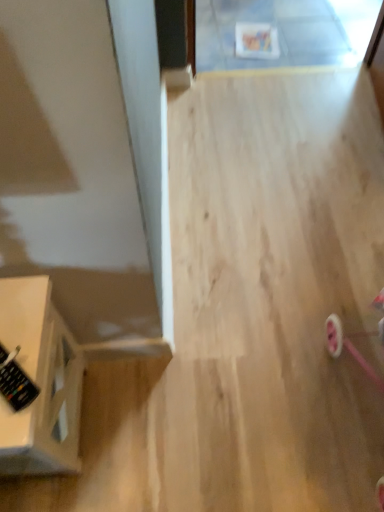
Question: Is black plastic remote at lower left inside the boundaries of white glossy side table at left, or outside?

Choices:
 (A) outside
 (B) inside

Answer: (A)

Question: In terms of width, does black plastic remote at lower left look wider or thinner when compared to white glossy side table at left?

Choices:
 (A) thin
 (B) wide

Answer: (A)

Question: Considering their positions, is black plastic remote at lower left located in front of or behind white glossy side table at left?

Choices:
 (A) behind
 (B) front

Answer: (A)

Question: Choose the correct answer: Is white glossy side table at left inside black plastic remote at lower left or outside it?

Choices:
 (A) outside
 (B) inside

Answer: (A)

Question: Does point (x=34, y=461) appear closer or farther from the camera than point (x=23, y=380)?

Choices:
 (A) farther
 (B) closer

Answer: (A)

Question: Considering the positions of white glossy side table at left and black plastic remote at lower left in the image, is white glossy side table at left wider or thinner than black plastic remote at lower left?

Choices:
 (A) thin
 (B) wide

Answer: (B)

Question: Is white glossy side table at left in front of or behind black plastic remote at lower left in the image?

Choices:
 (A) front
 (B) behind

Answer: (A)